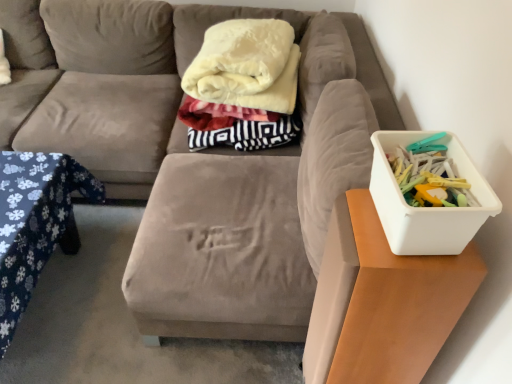
Question: Are white plastic container at right and white plastic container at right, the 2th table from the left, far apart?

Choices:
 (A) yes
 (B) no

Answer: (B)

Question: Is white plastic container at right at the left side of white plastic container at right, the 2th table from the left?

Choices:
 (A) yes
 (B) no

Answer: (B)

Question: From the image's perspective, is white plastic container at right below white plastic container at right, the 2th table from the left?

Choices:
 (A) yes
 (B) no

Answer: (B)

Question: Can you confirm if white plastic container at right is shorter than white plastic container at right, which is counted as the first table, starting from the right?

Choices:
 (A) no
 (B) yes

Answer: (B)

Question: Considering the relative sizes of white plastic container at right and white plastic container at right, the 2th table from the left, in the image provided, is white plastic container at right wider than white plastic container at right, the 2th table from the left,?

Choices:
 (A) yes
 (B) no

Answer: (B)

Question: Is white plastic container at right facing away from white plastic container at right, the 2th table from the left?

Choices:
 (A) yes
 (B) no

Answer: (B)

Question: Is white plastic container at right, the 2th table from the left, completely or partially outside of soft cream fleece blanket at center?

Choices:
 (A) no
 (B) yes

Answer: (B)

Question: Does white plastic container at right, the 2th table from the left, have a greater height compared to soft cream fleece blanket at center?

Choices:
 (A) no
 (B) yes

Answer: (B)

Question: Considering the relative sizes of white plastic container at right, the 2th table from the left, and soft cream fleece blanket at center in the image provided, is white plastic container at right, the 2th table from the left, thinner than soft cream fleece blanket at center?

Choices:
 (A) no
 (B) yes

Answer: (B)

Question: Does white plastic container at right, which is counted as the first table, starting from the right, have a lesser height compared to soft cream fleece blanket at center?

Choices:
 (A) no
 (B) yes

Answer: (A)

Question: From the image's perspective, is white plastic container at right, which is counted as the first table, starting from the right, beneath soft cream fleece blanket at center?

Choices:
 (A) no
 (B) yes

Answer: (B)

Question: From a real-world perspective, does white plastic container at right stand above velvet beige couch at center?

Choices:
 (A) no
 (B) yes

Answer: (B)